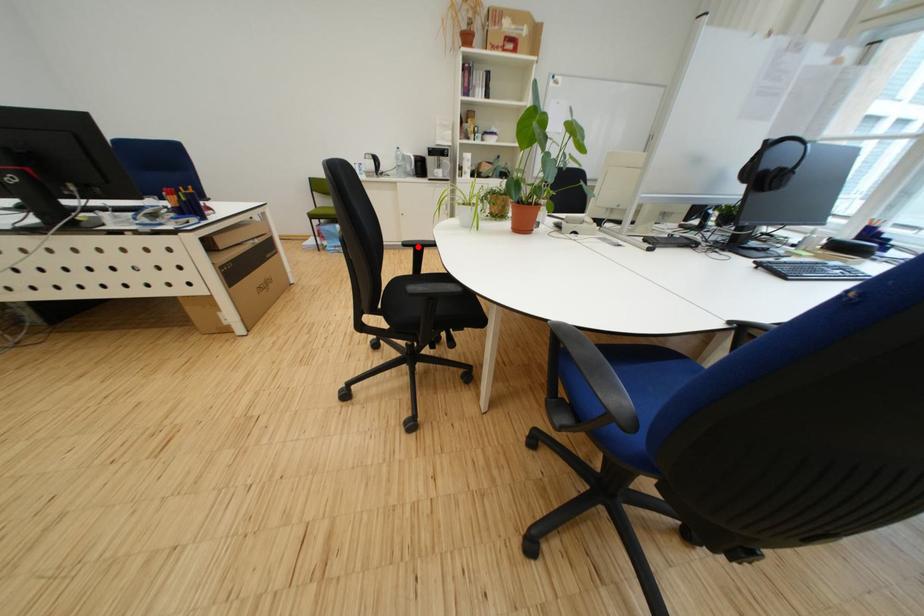
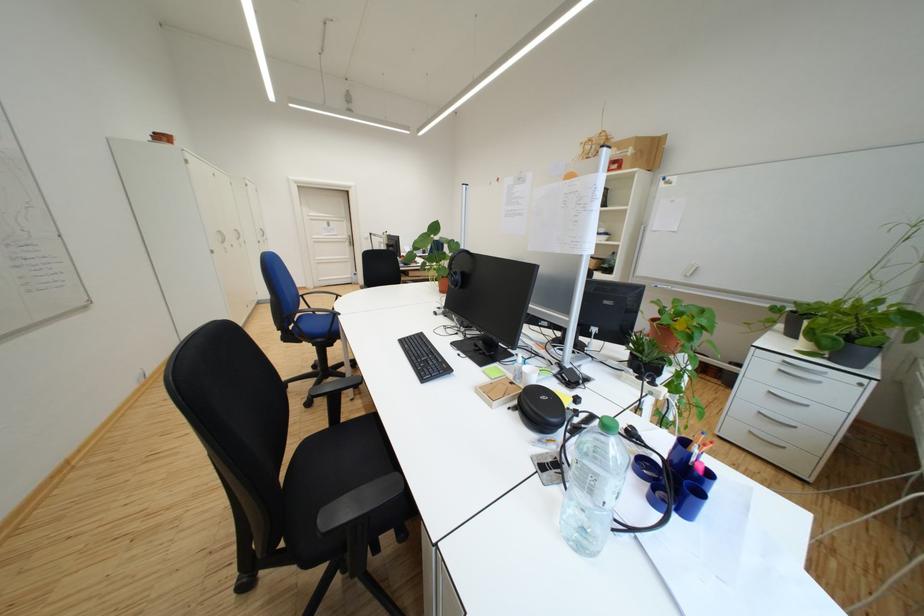
Question: I am providing you with two images of the same scene from different viewpoints. A red point is marked on the first image. At the location where the point appears in image 1, is it still visible in image 2?

Choices:
 (A) Yes
 (B) No

Answer: (B)